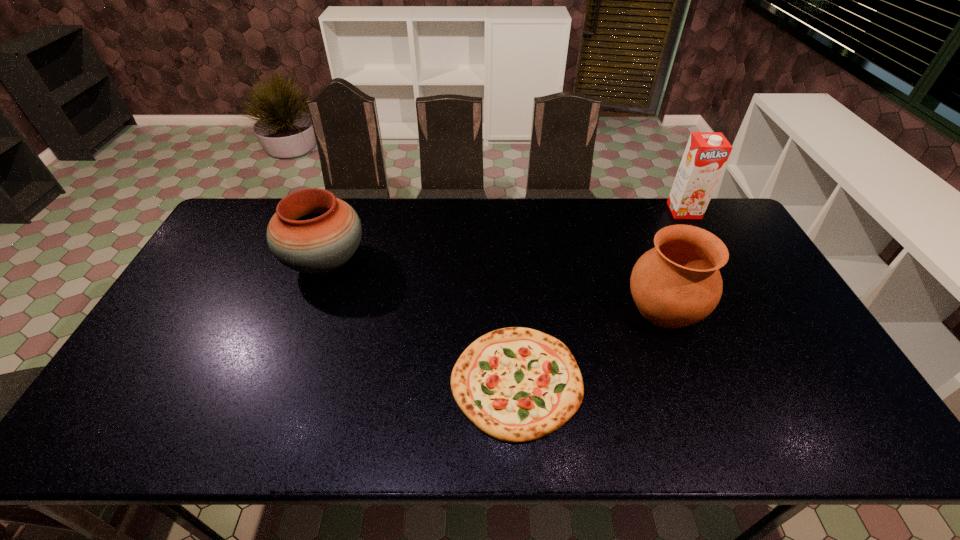
The width and height of the screenshot is (960, 540). Find the location of `carton at the far edge`. carton at the far edge is located at coordinates (706, 153).

Where is `pottery situated at the far edge`? pottery situated at the far edge is located at coordinates (312, 231).

At what (x,y) coordinates should I click in order to perform the action: click on object at the near edge. Please return your answer as a coordinate pair (x, y). The width and height of the screenshot is (960, 540). Looking at the image, I should click on (516, 384).

This screenshot has height=540, width=960. What are the coordinates of `object at the right edge` in the screenshot? It's located at (706, 153).

The height and width of the screenshot is (540, 960). I want to click on object positioned at the far right corner, so coord(706,153).

In the image, there is a desktop. At what (x,y) coordinates should I click in order to perform the action: click on vacant space at the far edge. Please return your answer as a coordinate pair (x, y). Looking at the image, I should click on (458, 231).

This screenshot has width=960, height=540. Find the location of `free space at the near edge of the desktop`. free space at the near edge of the desktop is located at coordinates (216, 421).

This screenshot has height=540, width=960. Identify the location of free region at the left edge. (233, 280).

This screenshot has height=540, width=960. I want to click on free region at the right edge of the desktop, so click(740, 307).

At what (x,y) coordinates should I click in order to perform the action: click on free point between the right pottery and the shortest object. Please return your answer as a coordinate pair (x, y). This screenshot has width=960, height=540. Looking at the image, I should click on (590, 345).